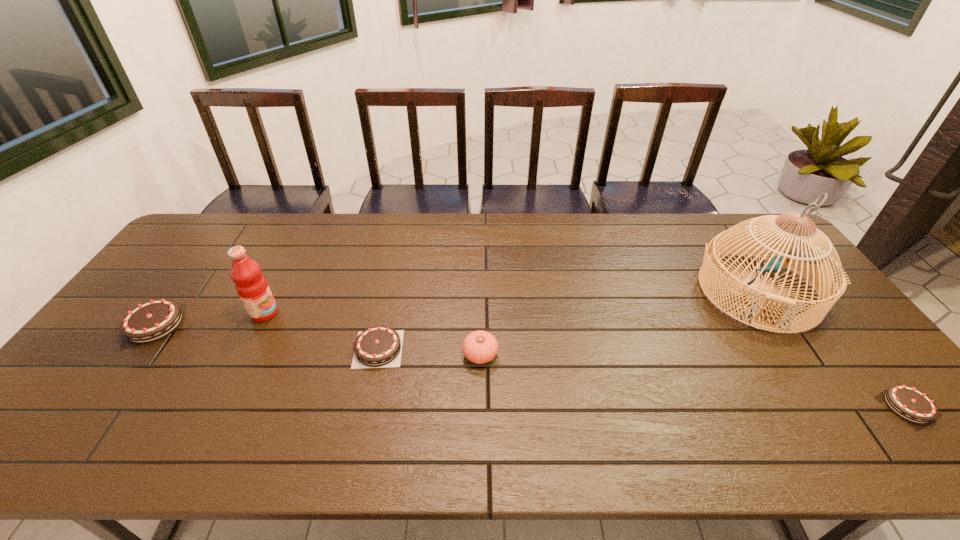
Where is `vacant position in the image that satisfies the following two spatial constraints: 1. on the front label of the third tallest object; 2. on the left side of the second object from left to right`? This screenshot has height=540, width=960. vacant position in the image that satisfies the following two spatial constraints: 1. on the front label of the third tallest object; 2. on the left side of the second object from left to right is located at coordinates (244, 355).

Where is `blank space that satisfies the following two spatial constraints: 1. on the front label of the fourth object from right to left; 2. on the left side of the fruit juice`? This screenshot has height=540, width=960. blank space that satisfies the following two spatial constraints: 1. on the front label of the fourth object from right to left; 2. on the left side of the fruit juice is located at coordinates (247, 349).

Locate an element on the screen. The image size is (960, 540). free region that satisfies the following two spatial constraints: 1. on the front label of the second chocolate cake from right to left; 2. on the left side of the second object from left to right is located at coordinates (247, 349).

I want to click on free space in the image that satisfies the following two spatial constraints: 1. on the front side of the shortest chocolate cake; 2. on the left side of the tallest object, so click(836, 406).

The width and height of the screenshot is (960, 540). Find the location of `vacant space that satisfies the following two spatial constraints: 1. on the front side of the fourth tallest object; 2. on the right side of the fourth object from right to left`. vacant space that satisfies the following two spatial constraints: 1. on the front side of the fourth tallest object; 2. on the right side of the fourth object from right to left is located at coordinates (137, 349).